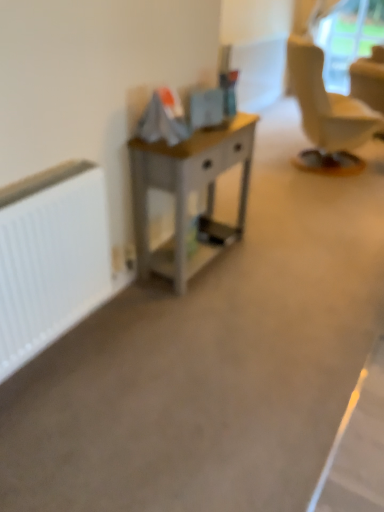
Question: Can you confirm if white matte radiator at left is positioned to the left of wooden desk at center?

Choices:
 (A) yes
 (B) no

Answer: (A)

Question: Is white matte radiator at left wider than wooden desk at center?

Choices:
 (A) yes
 (B) no

Answer: (B)

Question: Does white matte radiator at left come behind wooden desk at center?

Choices:
 (A) no
 (B) yes

Answer: (A)

Question: Is white matte radiator at left facing away from wooden desk at center?

Choices:
 (A) yes
 (B) no

Answer: (B)

Question: Is white matte radiator at left not near wooden desk at center?

Choices:
 (A) yes
 (B) no

Answer: (B)

Question: Looking at their shapes, would you say white matte radiator at left is wider or thinner than transparent plastic window screen at upper right?

Choices:
 (A) wide
 (B) thin

Answer: (A)

Question: In terms of size, does white matte radiator at left appear bigger or smaller than transparent plastic window screen at upper right?

Choices:
 (A) big
 (B) small

Answer: (B)

Question: Is point (46, 324) positioned closer to the camera than point (345, 33)?

Choices:
 (A) closer
 (B) farther

Answer: (A)

Question: Visually, is white matte radiator at left positioned to the left or to the right of transparent plastic window screen at upper right?

Choices:
 (A) right
 (B) left

Answer: (B)

Question: From their relative heights in the image, would you say wooden desk at center is taller or shorter than white matte radiator at left?

Choices:
 (A) tall
 (B) short

Answer: (A)

Question: Is wooden desk at center inside the boundaries of white matte radiator at left, or outside?

Choices:
 (A) inside
 (B) outside

Answer: (B)

Question: From the image's perspective, is wooden desk at center above or below white matte radiator at left?

Choices:
 (A) below
 (B) above

Answer: (B)

Question: From a real-world perspective, is wooden desk at center physically located above or below white matte radiator at left?

Choices:
 (A) below
 (B) above

Answer: (A)

Question: From the image's perspective, is transparent plastic window screen at upper right above or below wooden desk at center?

Choices:
 (A) above
 (B) below

Answer: (A)

Question: Considering the positions of point (329, 31) and point (137, 251), is point (329, 31) closer or farther from the camera than point (137, 251)?

Choices:
 (A) farther
 (B) closer

Answer: (A)